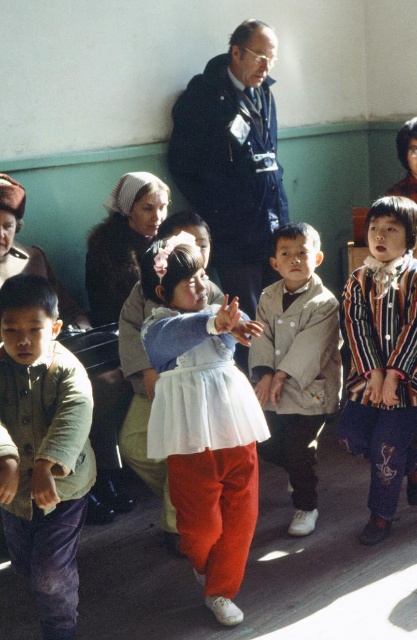
Does matte green jacket at lower left have a greater height compared to dark blue jacket at upper center?

No, matte green jacket at lower left is not taller than dark blue jacket at upper center.

Does matte green jacket at lower left appear on the right side of dark blue jacket at upper center?

In fact, matte green jacket at lower left is to the left of dark blue jacket at upper center.

Between point (52, 394) and point (215, 144), which one is positioned in front?

Point (52, 394) is more forward.

This screenshot has height=640, width=417. In order to click on matte green jacket at lower left in this screenshot , I will do `click(45, 449)`.

Does striped fabric shirt at center have a greater width compared to light beige fabric jacket at center?

In fact, striped fabric shirt at center might be narrower than light beige fabric jacket at center.

Can you confirm if striped fabric shirt at center is smaller than light beige fabric jacket at center?

Incorrect, striped fabric shirt at center is not smaller in size than light beige fabric jacket at center.

Does point (404, 275) come farther from viewer compared to point (319, 280)?

No, (404, 275) is closer to viewer.

This screenshot has height=640, width=417. What are the coordinates of `striped fabric shirt at center` in the screenshot? It's located at (382, 360).

Can you confirm if dark blue jacket at upper center is positioned to the right of light beige fabric jacket at center?

Incorrect, dark blue jacket at upper center is not on the right side of light beige fabric jacket at center.

Can you confirm if dark blue jacket at upper center is shorter than light beige fabric jacket at center?

Incorrect, dark blue jacket at upper center's height does not fall short of light beige fabric jacket at center's.

Is point (213, 176) positioned in front of point (291, 264)?

No.

The height and width of the screenshot is (640, 417). Identify the location of dark blue jacket at upper center. (233, 160).